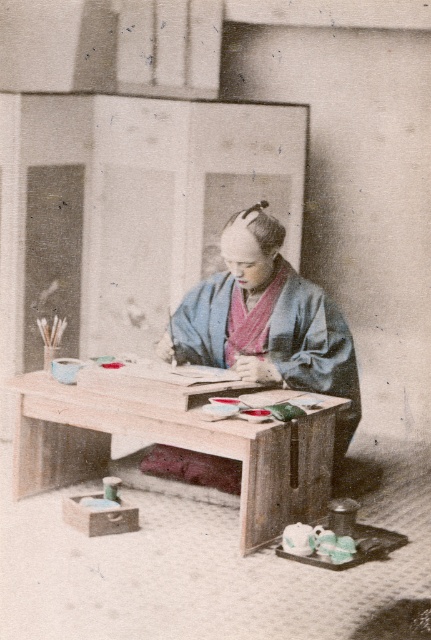
You are a tailor who needs to measure the blue silk kimono at center to create a replica. The wooden table at center is available for use. Can you place the kimono on the table without folding it?

The wooden table at center is larger in size than the blue silk kimono at center, so yes, the kimono can be placed on the table without folding it.

You are a tailor who needs to measure the space between the wooden table at center and the blue silk kimono at center to determine if a new silk fabric roll can fit between them. The fabric roll is 17 inches in diameter. Can the fabric roll fit between them?

The distance between the wooden table at center and the blue silk kimono at center is 18.12 inches. Since the fabric roll is 17 inches in diameter, it can fit between them as the space is slightly larger than the roll.

You are an anthropologist examining this vintage photograph. You notice the wooden table at center and the blue silk kimono at center. Based on their positions, which object is closer to the viewer?

The blue silk kimono at center is closer to the viewer because it is positioned above the wooden table at center, which is placed below it.